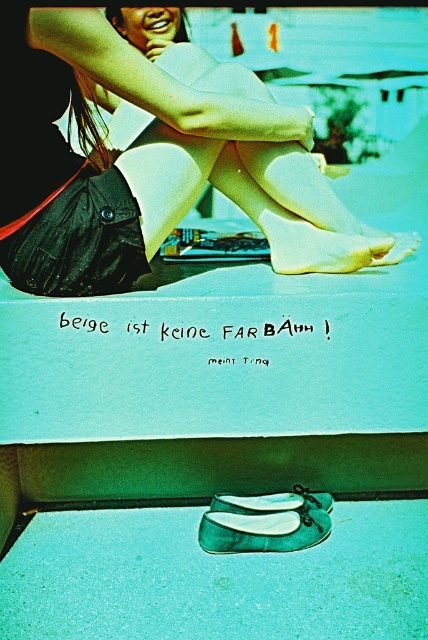
You are a delivery robot with a 1.5 inch wide package. You need to place the package between the green leather shoes at lower center and the matte green shoe at lower center. Is there enough space for the package between them?

The green leather shoes at lower center and the matte green shoe at lower center are 1.06 inches apart from each other. Since the package is 1.5 inches wide, there isn not enough space to place the package between them.

You are organizing a small exhibition and need to place the matte black bag at lower left and the matte green shoe at lower center on a shelf. The shelf has a width limit of 30 cm. If the combined width of both items is 35 cm, will they fit together on the shelf?

The combined width of the matte black bag at lower left and the matte green shoe at lower center is 35 cm, which exceeds the shelf width limit of 30 cm. Therefore, they cannot fit together on the shelf.

You are an artist planning to place a new element in the image. You want to position it exactly where the matte black bag at lower left is currently located. What are the coordinates of that position?

The coordinates of the position where the matte black bag at lower left is located are at point (149, 160).